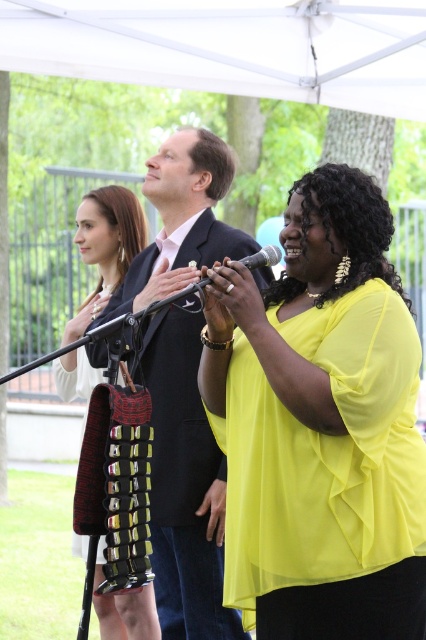
Question: Among these points, which one is nearest to the camera?

Choices:
 (A) (66, 36)
 (B) (149, 632)
 (C) (172, 132)
 (D) (357, 387)

Answer: (D)

Question: Based on their relative distances, which object is nearer to the yellow sheer blouse at center?

Choices:
 (A) black textured dress at left
 (B) white fabric canopy at upper center
 (C) matte black suit at center

Answer: (C)

Question: In this image, where is yellow sheer blouse at center located relative to white fabric canopy at upper center?

Choices:
 (A) below
 (B) above

Answer: (A)

Question: Which point is closer to the camera taking this photo?

Choices:
 (A) (164, 36)
 (B) (117, 257)
 (C) (227, 433)

Answer: (C)

Question: Can you confirm if yellow sheer blouse at center is smaller than black textured dress at left?

Choices:
 (A) no
 (B) yes

Answer: (A)

Question: Is white fabric canopy at upper center closer to camera compared to matte black suit at center?

Choices:
 (A) no
 (B) yes

Answer: (A)